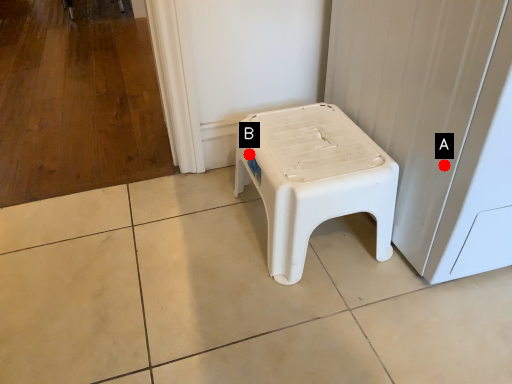
Question: Two points are circled on the image, labeled by A and B beside each circle. Which point is farther from the camera taking this photo?

Choices:
 (A) A is further
 (B) B is further

Answer: (B)